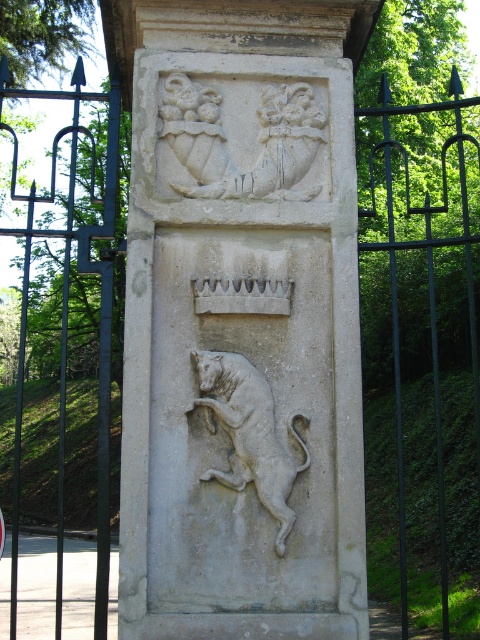
Does white stone coat of arms at upper center have a greater width compared to white stone lion at center?

Correct, the width of white stone coat of arms at upper center exceeds that of white stone lion at center.

Is point (263, 132) positioned behind point (264, 380)?

Yes, it is.

I want to click on white stone coat of arms at upper center, so click(x=226, y=140).